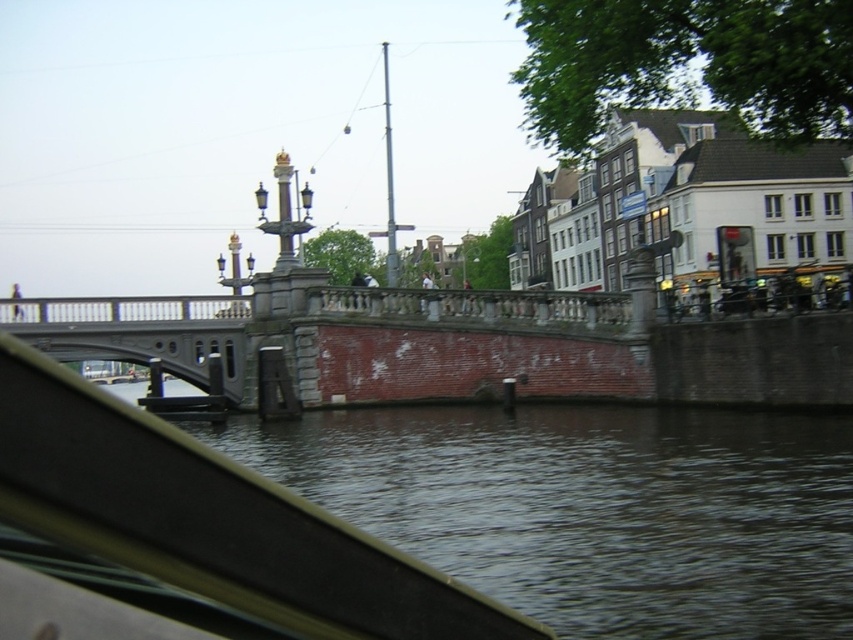
You are navigating a small boat on the canal and need to pass between two points marked on your map. The first point is at coordinates point (293, 426) and the second is at point (141, 317). Based on the scene, which point should you approach first to stay on course?

You should approach point (293, 426) first because it is in front of point (141, 317), so it comes before the second point along your path.

You are a tourist standing on the deck of a boat in the canal. You see the dark water at lower center and the gray concrete bridge at center. Which object is closer to you?

The dark water at lower center is closer to you because it is positioned below the gray concrete bridge at center, placing it nearer in the visual hierarchy.